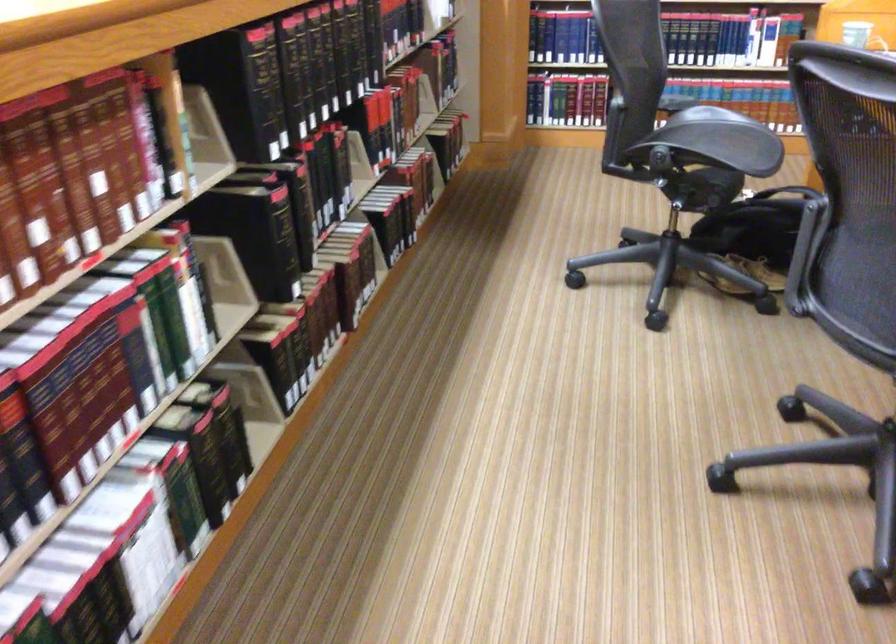
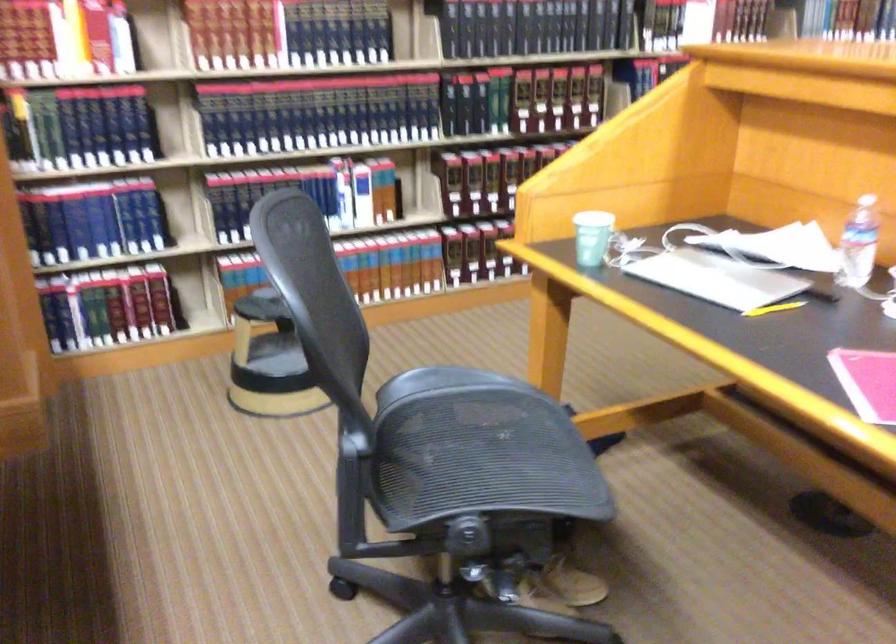
In the second image, find the point that corresponds to [707,135] in the first image.

(470, 442)